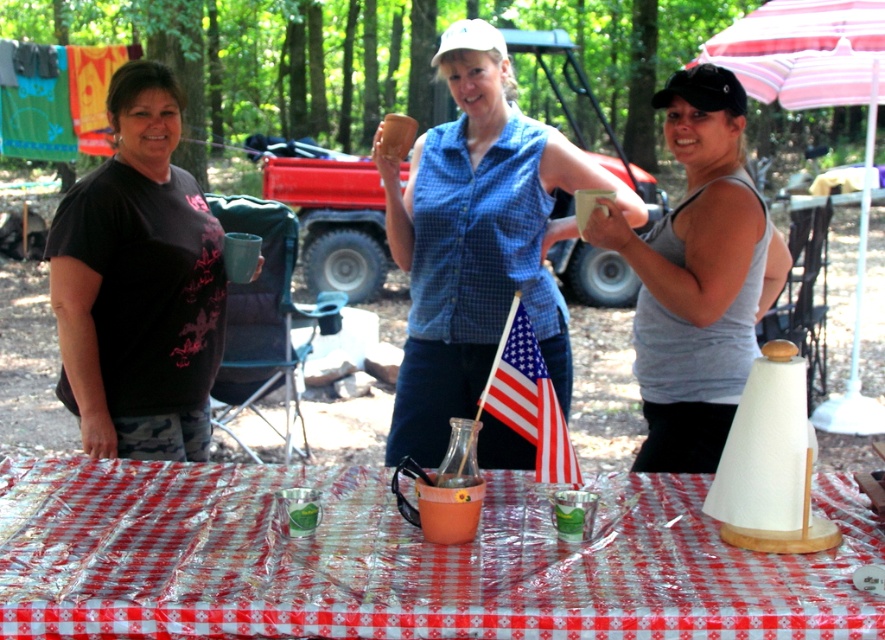
What is located at the coordinates point (401, 560)?

The point (401, 560) corresponds to the red checkered plastic at center.

You are at a picnic table in a wooded area. You see a red checkered plastic at center and a blue checkered shirt at center. Which object is positioned to the left?

The red checkered plastic at center is to the left of the blue checkered shirt at center.

You are standing next to the camera and want to grab the red checkered plastic at center to set up a drink. Can you reach it without moving your feet?

The red checkered plastic at center is 1.75 meters away from the camera. Since the average human arm length is about 0.7 meters, you cannot reach it without moving your feet.